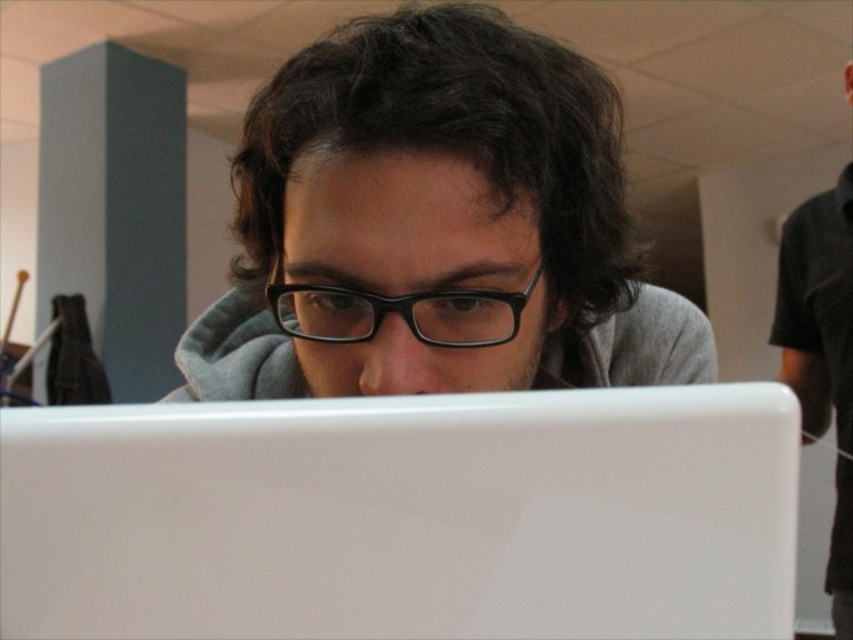
Does matte black glasses at center have a lesser height compared to black matte shirt at right?

Correct, matte black glasses at center is not as tall as black matte shirt at right.

Between point (415, 173) and point (798, 317), which one is positioned behind?

The point (798, 317) is behind.

Find the location of a particular element. This screenshot has width=853, height=640. matte black glasses at center is located at coordinates (437, 218).

Does matte black glasses at center have a lesser height compared to black plastic glasses at center?

In fact, matte black glasses at center may be taller than black plastic glasses at center.

Which of these two, matte black glasses at center or black plastic glasses at center, stands shorter?

With less height is black plastic glasses at center.

Is point (368, 150) in front of point (489, 346)?

Yes, point (368, 150) is closer to viewer.

The width and height of the screenshot is (853, 640). I want to click on matte black glasses at center, so click(437, 218).

Is white glossy laptop at center to the right of matte black glasses at center from the viewer's perspective?

In fact, white glossy laptop at center is to the left of matte black glasses at center.

How distant is white glossy laptop at center from matte black glasses at center?

white glossy laptop at center is 10.43 inches from matte black glasses at center.

What are the coordinates of `white glossy laptop at center` in the screenshot? It's located at [404, 516].